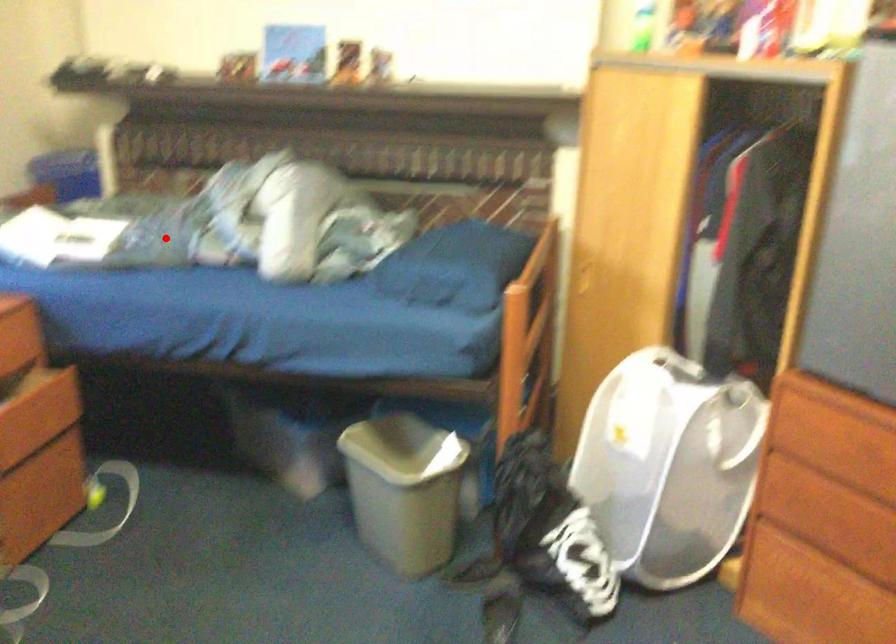
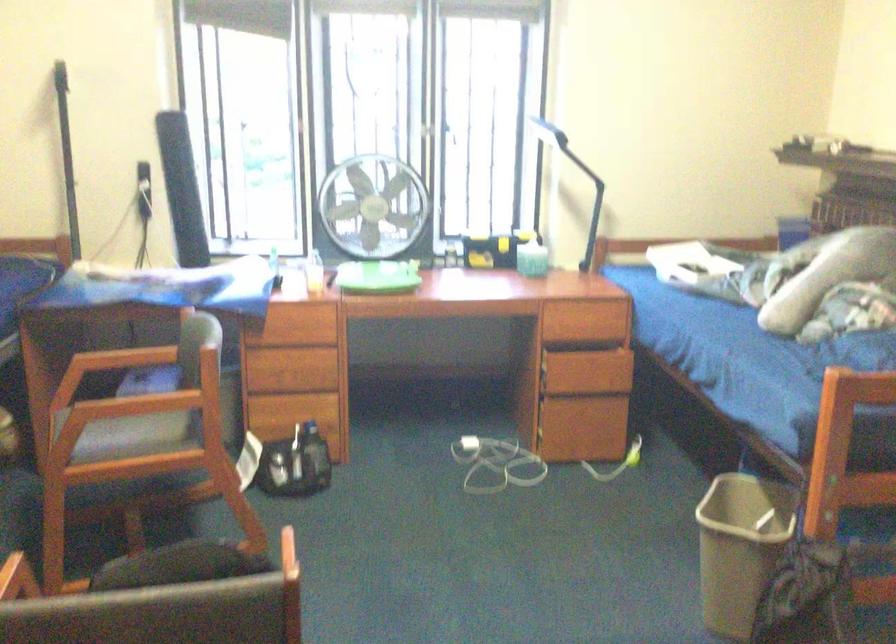
Question: A red point is marked in image1. In image2, is the corresponding 3D point closer to the camera or farther? Reply with the corresponding letter.

Choices:
 (A) The corresponding 3D point is closer.
 (B) The corresponding 3D point is farther.

Answer: (B)